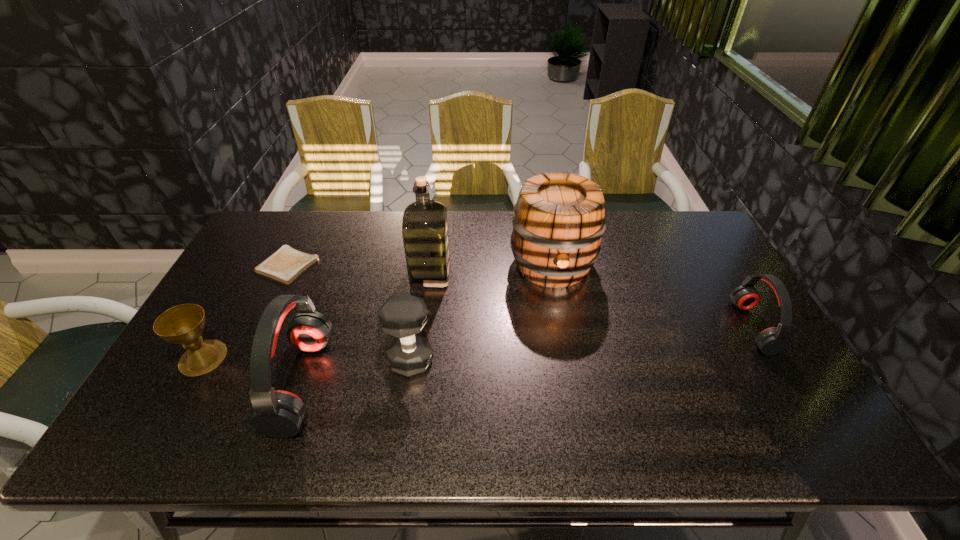
Where is `chalice positioned at the left edge`? chalice positioned at the left edge is located at coordinates (183, 324).

In order to click on object situated at the right edge in this screenshot , I will do [x=771, y=341].

Image resolution: width=960 pixels, height=540 pixels. I want to click on object present at the far left corner, so click(x=286, y=264).

Locate an element on the screen. The width and height of the screenshot is (960, 540). vacant space at the far edge of the desktop is located at coordinates (400, 251).

In order to click on free space at the near edge in this screenshot , I will do `click(339, 401)`.

Locate an element on the screen. free space at the right edge is located at coordinates (709, 286).

Where is `empty space that is in between the second object from right to left and the fourth shortest object`? empty space that is in between the second object from right to left and the fourth shortest object is located at coordinates (482, 313).

You are a GUI agent. You are given a task and a screenshot of the screen. Output one action in this format:
    pyautogui.click(x=<x>, y=<y>)
    Task: Click on the vacant point located between the dumbbell and the toast
    
    Given the screenshot: What is the action you would take?
    pyautogui.click(x=349, y=313)

I want to click on vacant region between the shortest object and the fourth shortest object, so click(x=349, y=313).

Locate an element on the screen. free space between the right earphone and the dumbbell is located at coordinates (582, 343).